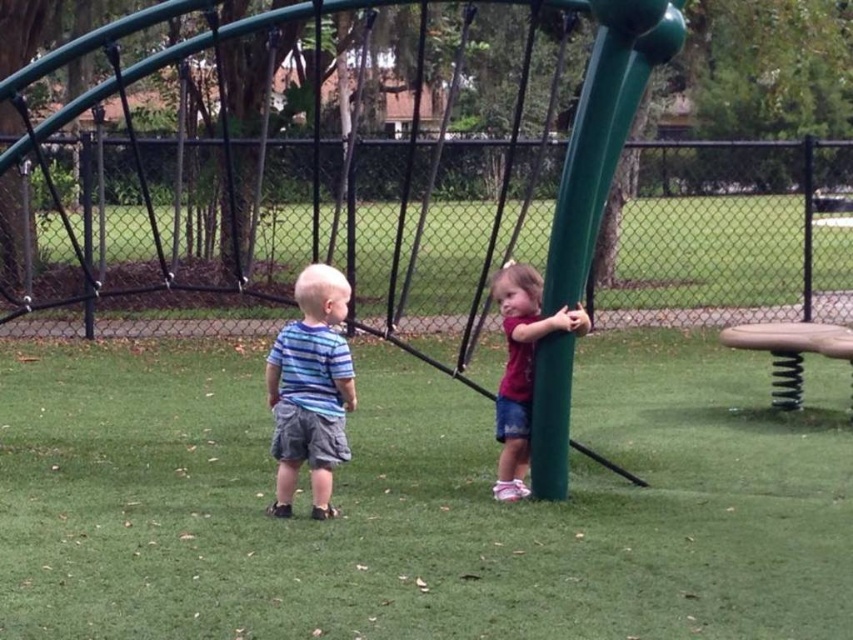
Question: Is blue striped shirt at left behind matte green pole at right?

Choices:
 (A) yes
 (B) no

Answer: (B)

Question: Is blue striped shirt at left to the right of matte green pole at right from the viewer's perspective?

Choices:
 (A) no
 (B) yes

Answer: (A)

Question: Which point appears farthest from the camera in this image?

Choices:
 (A) (291, 364)
 (B) (509, 448)

Answer: (B)

Question: Which point is closer to the camera taking this photo?

Choices:
 (A) (511, 282)
 (B) (335, 412)

Answer: (B)

Question: Is blue striped shirt at left positioned before matte green pole at right?

Choices:
 (A) yes
 (B) no

Answer: (A)